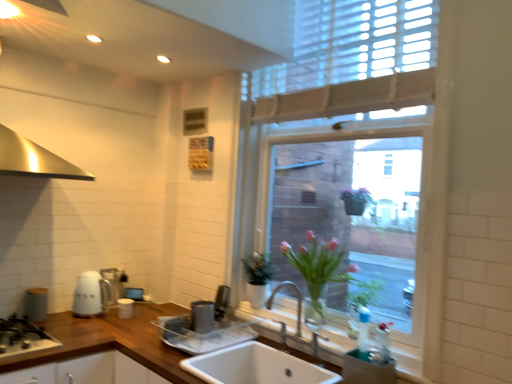
Question: Considering the positions of matte gray canister at left, which is the first appliance in left-to-right order, and transparent glass window at center in the image, is matte gray canister at left, which is the first appliance in left-to-right order, taller or shorter than transparent glass window at center?

Choices:
 (A) tall
 (B) short

Answer: (B)

Question: Considering the positions of matte gray canister at left, placed as the fifth appliance when sorted from right to left, and transparent glass window at center in the image, is matte gray canister at left, placed as the fifth appliance when sorted from right to left, bigger or smaller than transparent glass window at center?

Choices:
 (A) small
 (B) big

Answer: (A)

Question: Considering the real-world distances, which object is closest to the matte gray canister at left, the third appliance positioned from the back?

Choices:
 (A) wooden at center
 (B) transparent glass window at center
 (C) metallic silver dish drainer at lower right, the 5th appliance when ordered from back to front
 (D) satin silver toaster at lower center, acting as the 4th appliance starting from the back
 (E) white glossy kettle at lower left, which is the 4th appliance from front to back

Answer: (E)

Question: Which is nearer to the white ceramic sink at center?

Choices:
 (A) white ceramic sink at center
 (B) black matte gas stove at lower left
 (C) wooden at center
 (D) white glossy mug at lower left, which appears as the 1th appliance when viewed from the back
 (E) satin silver toaster at lower center, placed as the fourth appliance when sorted from left to right

Answer: (A)